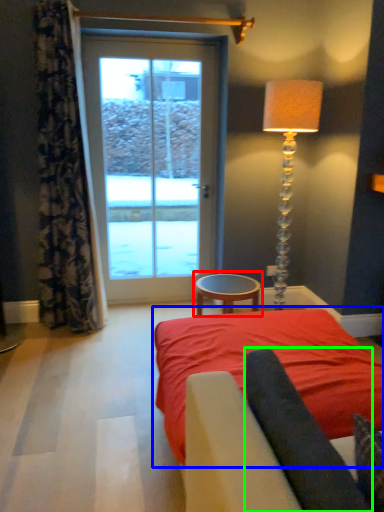
Question: Considering the real-world distances, which object is farthest from table (highlighted by a red box)? bed (highlighted by a blue box) or dark (highlighted by a green box)?

Choices:
 (A) bed
 (B) dark

Answer: (B)